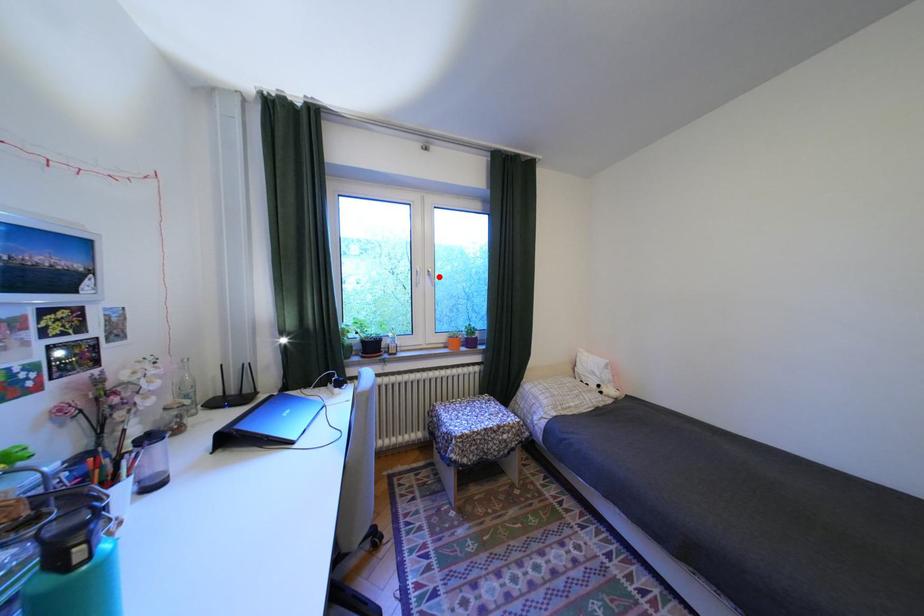
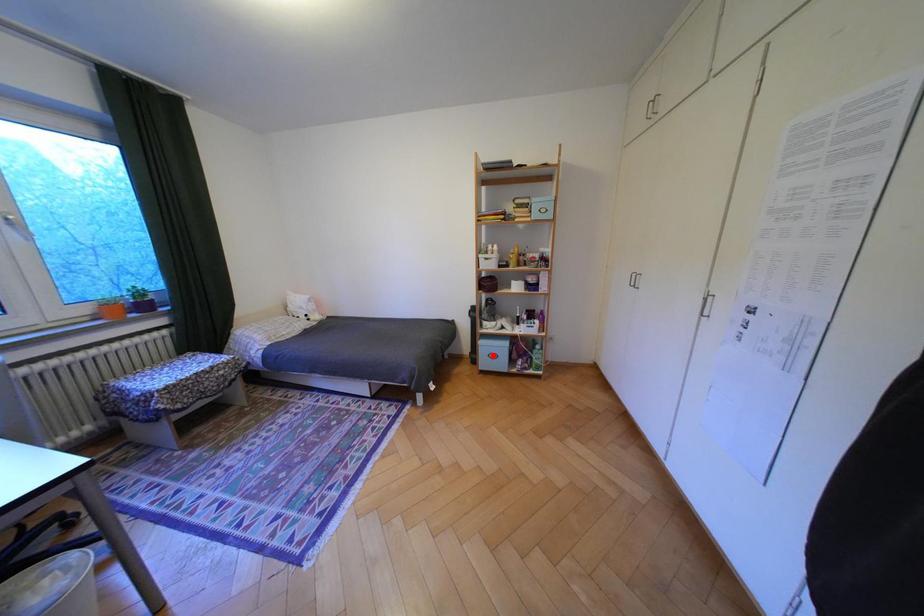
I am providing you with two images of the same scene from different viewpoints. A red point is marked on the first image and another point is marked on the second image. Does the point marked in image1 correspond to the same location as the one in image2?

No